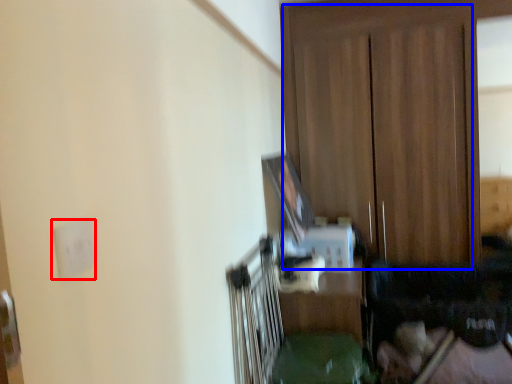
Question: Which point is closer to the camera, electric outlet (highlighted by a red box) or dresser (highlighted by a blue box)?

Choices:
 (A) electric outlet
 (B) dresser

Answer: (A)